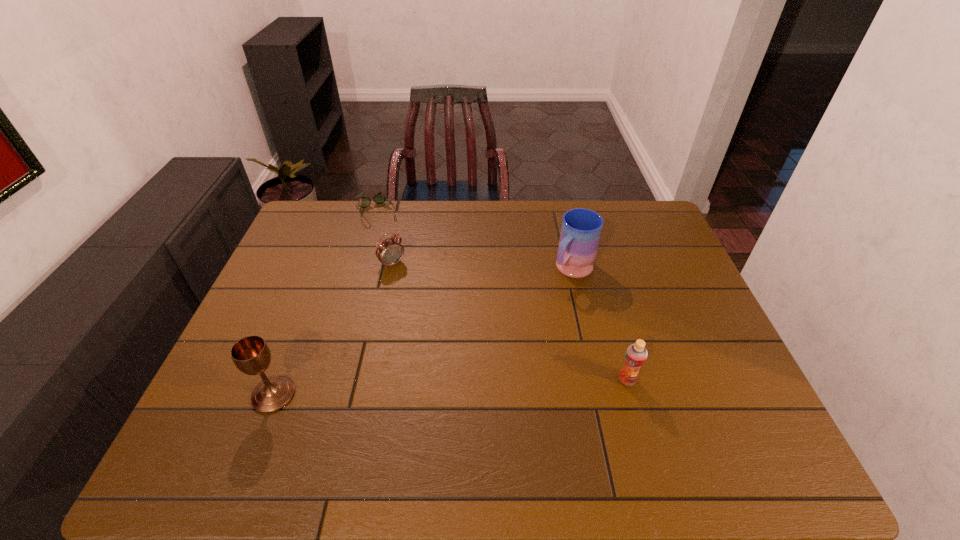
Locate an element on the screen. object located in the near left corner section of the desktop is located at coordinates (251, 355).

At what (x,y) coordinates should I click in order to perform the action: click on vacant space at the far edge of the desktop. Please return your answer as a coordinate pair (x, y). The image size is (960, 540). Looking at the image, I should click on (397, 233).

In order to click on vacant area at the near edge in this screenshot , I will do `click(444, 411)`.

In the image, there is a desktop. What are the coordinates of `free region at the left edge` in the screenshot? It's located at (267, 295).

This screenshot has height=540, width=960. Identify the location of free location at the right edge. (641, 256).

In order to click on vacant space at the far left corner of the desktop in this screenshot , I will do `click(303, 233)`.

Find the location of a particular element. This screenshot has height=540, width=960. vacant space that's between the orange juice and the shortest object is located at coordinates (501, 296).

I want to click on unoccupied position between the chalice and the alarm clock, so 333,329.

Where is `free space between the third tallest object and the second shortest object`? Image resolution: width=960 pixels, height=540 pixels. free space between the third tallest object and the second shortest object is located at coordinates (510, 322).

Where is `vacant region between the mug and the alarm clock`? This screenshot has height=540, width=960. vacant region between the mug and the alarm clock is located at coordinates (482, 267).